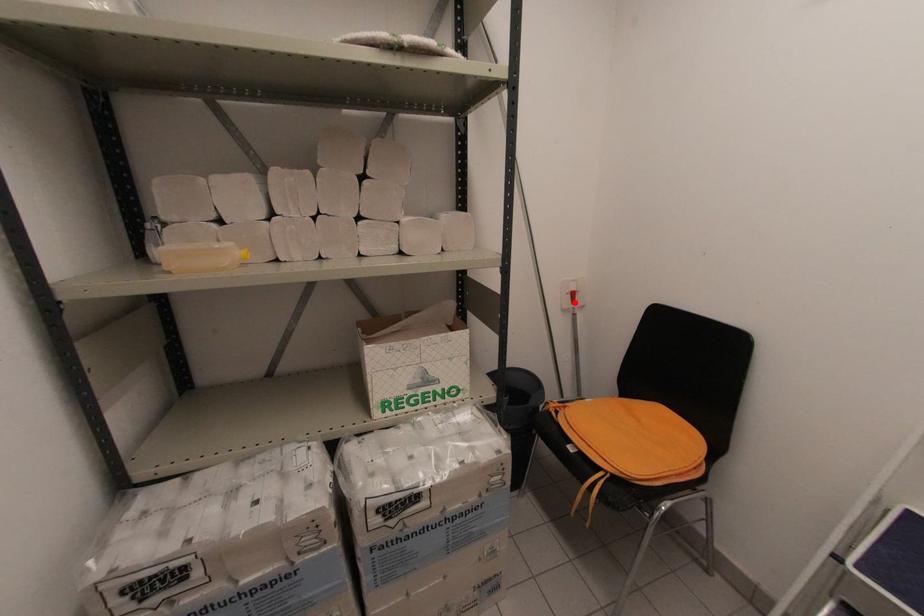
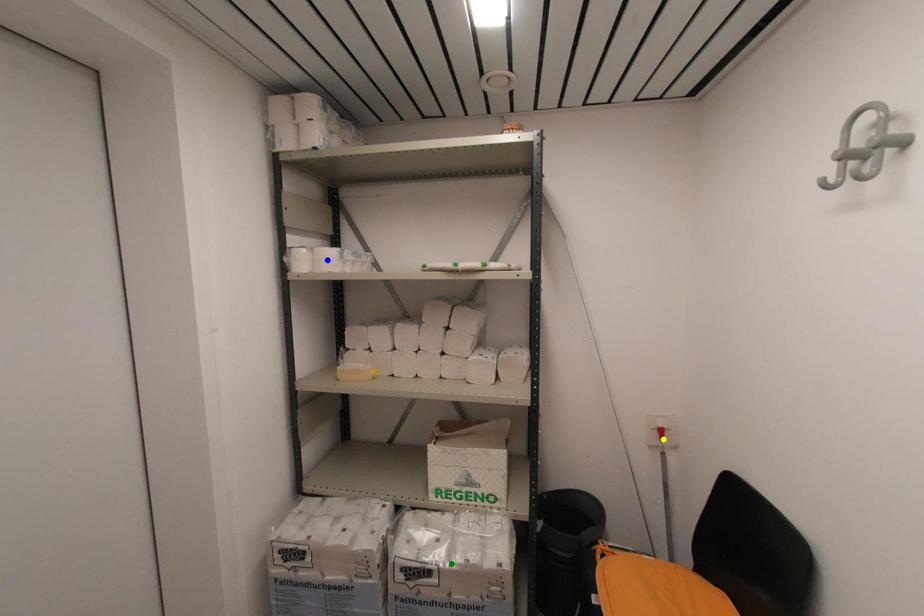
Question: I am providing you with two images of the same scene from different viewpoints. A red point is marked on the first image. You are given multiple points on the second image. Which spot in image 2 lines up with the point in image 1?

Choices:
 (A) yellow point
 (B) green point
 (C) blue point

Answer: (A)